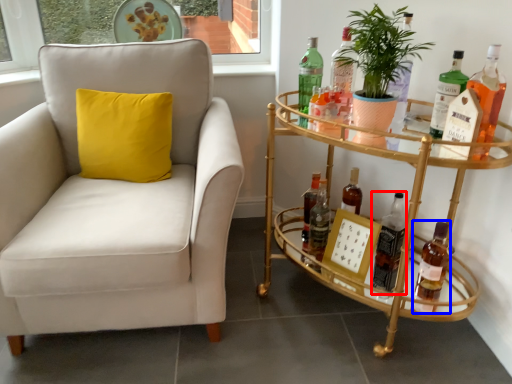
Question: Which of the following is the farthest to the observer, bottle (highlighted by a red box) or bottle (highlighted by a blue box)?

Choices:
 (A) bottle
 (B) bottle

Answer: (A)